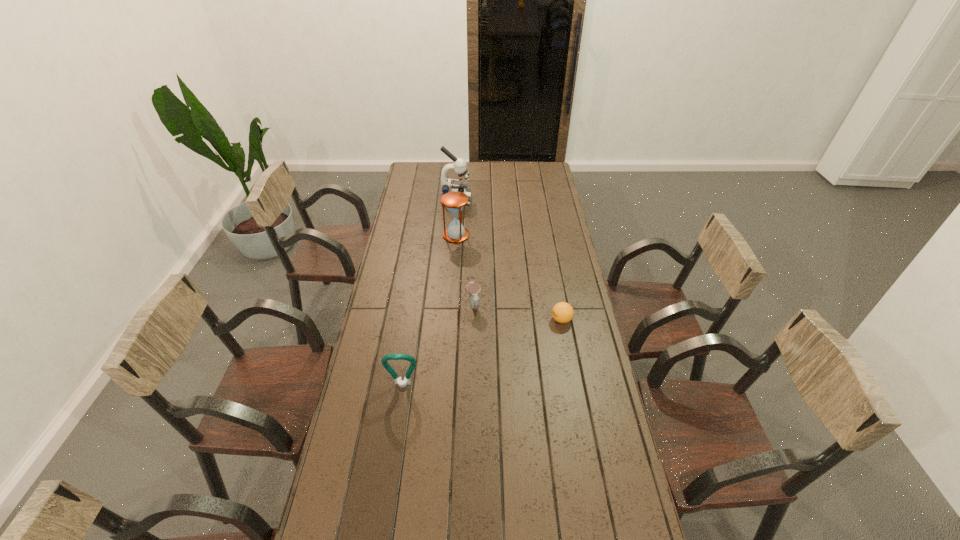
Find the location of a particular element. the tallest object is located at coordinates (447, 185).

Where is `the farthest object`? Image resolution: width=960 pixels, height=540 pixels. the farthest object is located at coordinates (447, 185).

Where is `hourglass`? hourglass is located at coordinates (454, 201).

You are a GUI agent. You are given a task and a screenshot of the screen. Output one action in this format:
    pyautogui.click(x=<x>, y=<y>)
    Task: Click on the nearest object
    Image resolution: width=960 pixels, height=540 pixels.
    Given the screenshot: What is the action you would take?
    pyautogui.click(x=402, y=383)

What are the coordinates of `bottle opener` in the screenshot? It's located at (402, 383).

Where is `watch`? Image resolution: width=960 pixels, height=540 pixels. watch is located at coordinates (472, 288).

This screenshot has height=540, width=960. Identify the location of the rightmost object. point(562,312).

Identify the location of ping-pong ball. (562, 312).

You are a GUI agent. You are given a task and a screenshot of the screen. Output one action in this format:
    pyautogui.click(x=<x>, y=<y>)
    Task: Click on the free space located 0.140m at the eyepiece of the tallest object
    The image size is (960, 540).
    Given the screenshot: What is the action you would take?
    pyautogui.click(x=497, y=199)

Find the location of a particular element. The image size is (960, 540). vacant area situated 0.250m on the back of the second farthest object is located at coordinates (459, 200).